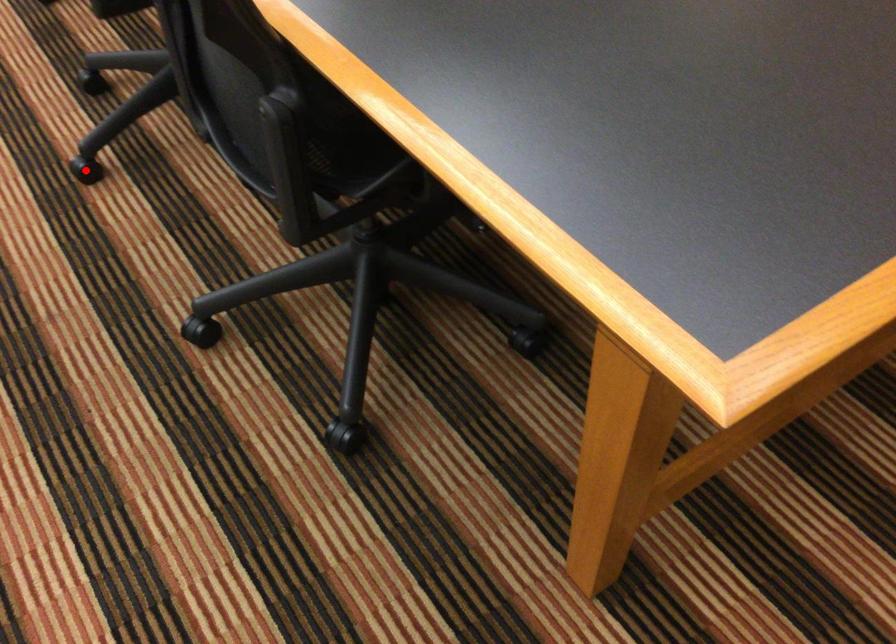
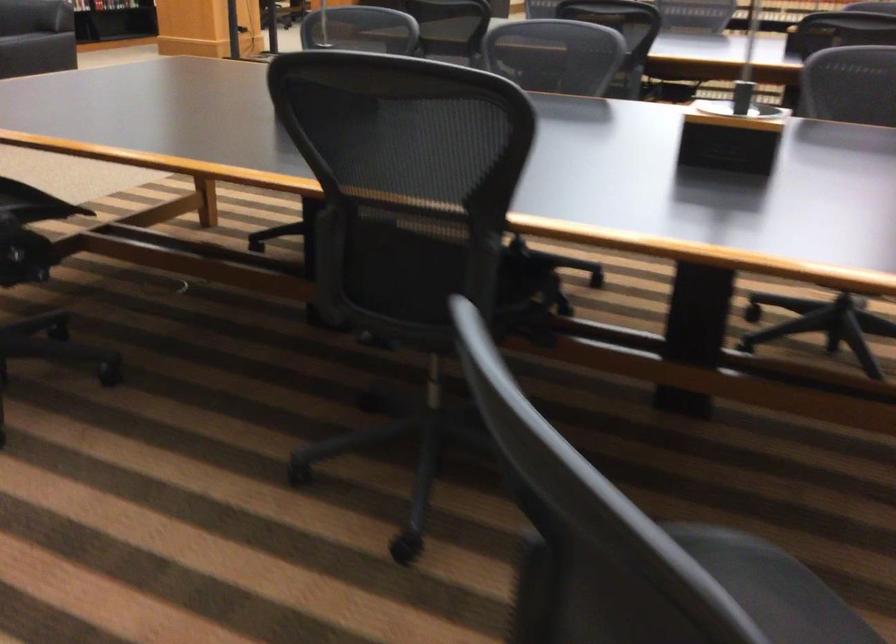
Question: I am providing you with two images of the same scene from different viewpoints. A red point is marked on the first image. Is the red point's position out of view in image 2?

Choices:
 (A) Yes
 (B) No

Answer: (A)